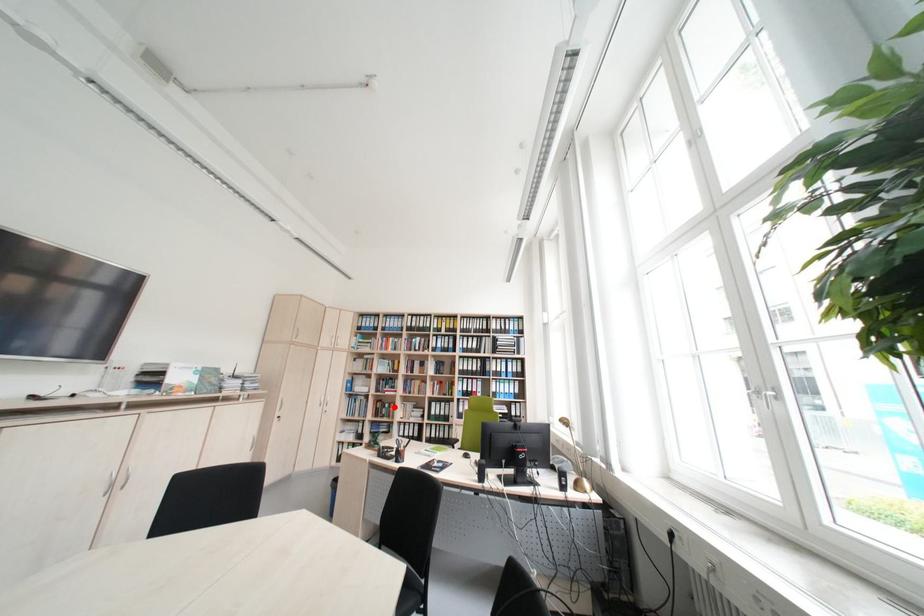
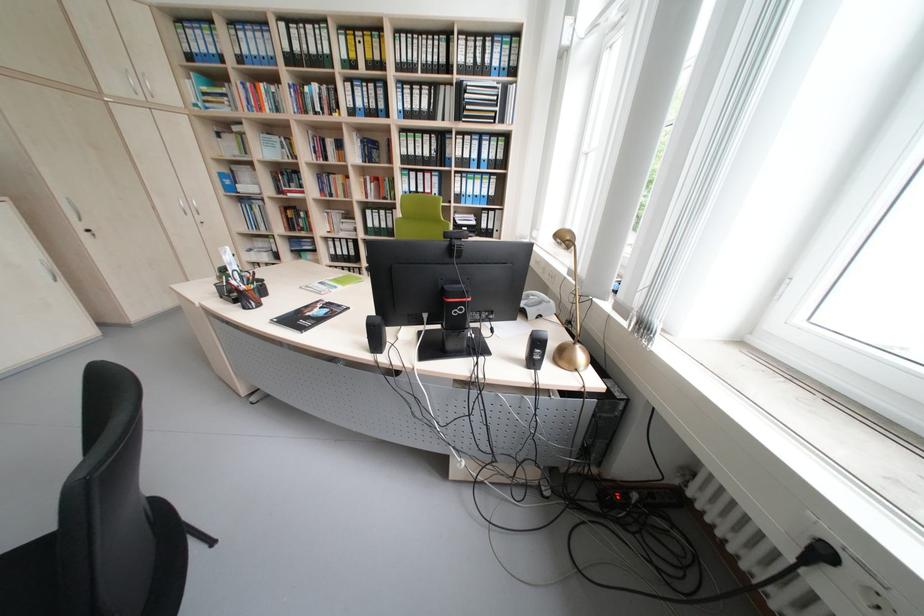
Question: I am providing you with two images of the same scene from different viewpoints. A red point is shown in image1. For the corresponding object point in image2, is it positioned nearer or farther from the camera?

Choices:
 (A) Nearer
 (B) Farther

Answer: (A)